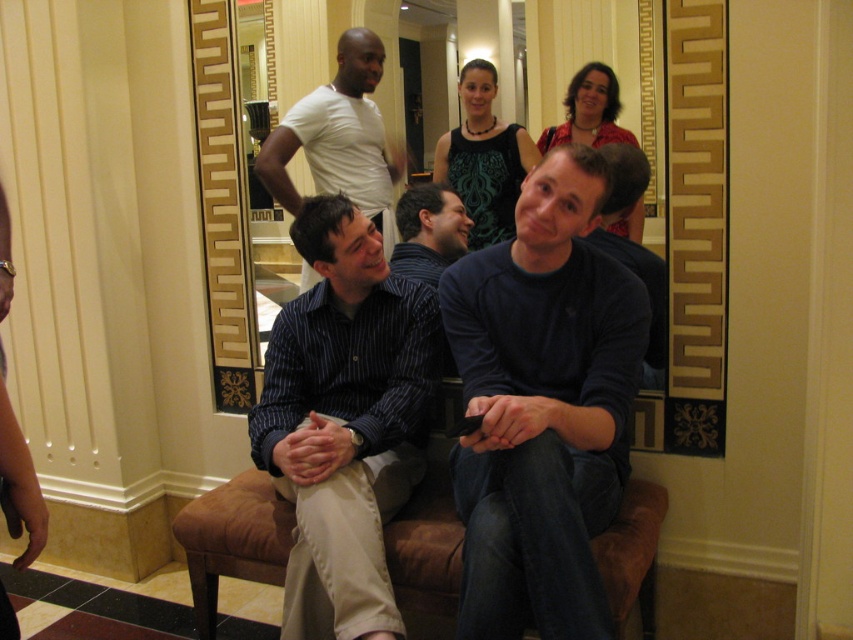
Does dark blue sweater at center have a lesser height compared to white matte t-shirt at upper center?

No.

Is point (575, 497) farther from viewer compared to point (267, 184)?

No, (575, 497) is in front of (267, 184).

Is point (585, 296) positioned after point (306, 272)?

That is False.

What are the coordinates of `dark blue sweater at center` in the screenshot? It's located at (543, 404).

Is dark blue sweater at center above blue striped shirt at center?

Correct, dark blue sweater at center is located above blue striped shirt at center.

Who is taller, dark blue sweater at center or blue striped shirt at center?

Standing taller between the two is blue striped shirt at center.

Which is behind, point (577, 602) or point (335, 637)?

The point (335, 637) is more distant.

Image resolution: width=853 pixels, height=640 pixels. I want to click on dark blue sweater at center, so click(543, 404).

Is dark blue sweater at center to the right of striped shirt at center from the viewer's perspective?

Correct, you'll find dark blue sweater at center to the right of striped shirt at center.

Does dark blue sweater at center lie in front of striped shirt at center?

Yes, it is.

Is point (537, 250) closer to viewer compared to point (405, 269)?

Yes, it is.

Locate an element on the screen. The width and height of the screenshot is (853, 640). dark blue sweater at center is located at coordinates (543, 404).